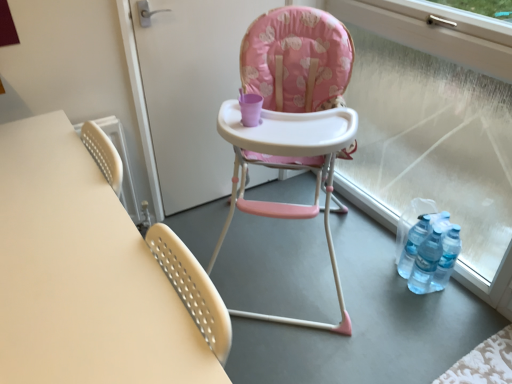
Find the location of `free space in front of transparent glass window at right`. free space in front of transparent glass window at right is located at coordinates (391, 311).